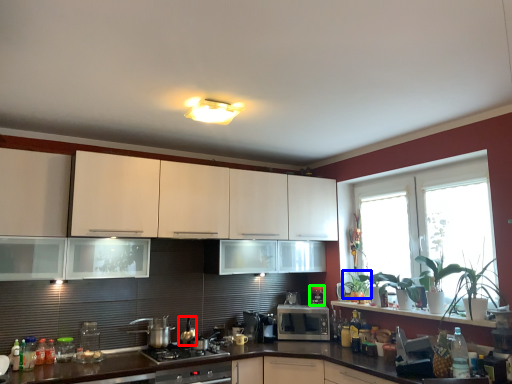
Question: Which object is positioned farthest from appliance (highlighted by a red box)? Select from plant (highlighted by a blue box) and coffee machine (highlighted by a green box).

Choices:
 (A) plant
 (B) coffee machine

Answer: (A)